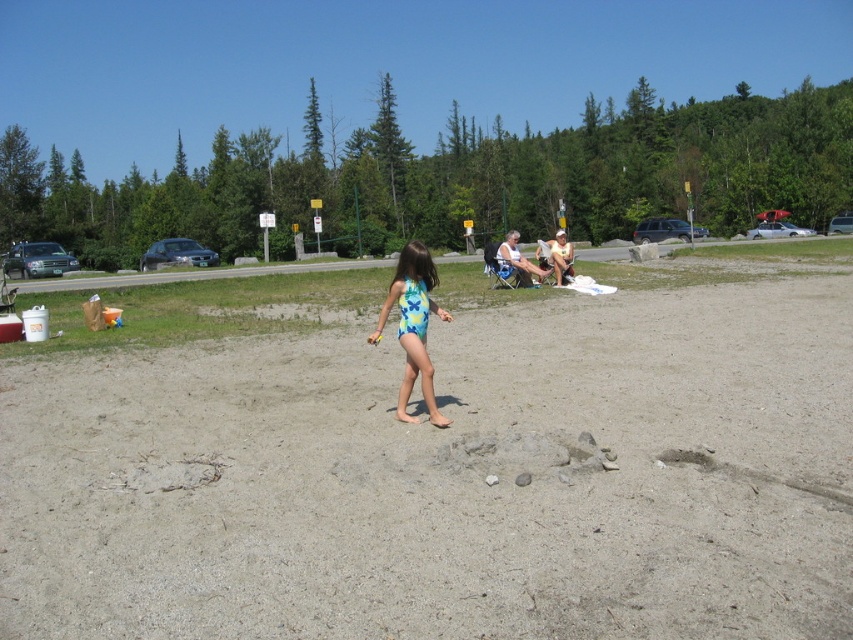
Question: Is gray sand at center below blue printed swimsuit at center?

Choices:
 (A) yes
 (B) no

Answer: (A)

Question: Which object appears closest to the camera in this image?

Choices:
 (A) gray sand at center
 (B) light brown wooden chair at center
 (C) blue printed swimsuit at center
 (D) white textured tank top at center

Answer: (A)

Question: Which object is the farthest from the white textured tank top at center?

Choices:
 (A) blue printed swimsuit at center
 (B) light brown wooden chair at center
 (C) gray sand at center

Answer: (C)

Question: Is gray sand at center wider than white textured tank top at center?

Choices:
 (A) yes
 (B) no

Answer: (A)

Question: Considering the relative positions of gray sand at center and blue printed swimsuit at center in the image provided, where is gray sand at center located with respect to blue printed swimsuit at center?

Choices:
 (A) left
 (B) right

Answer: (B)

Question: Among these objects, which one is nearest to the camera?

Choices:
 (A) gray sand at center
 (B) light brown wooden chair at center

Answer: (A)